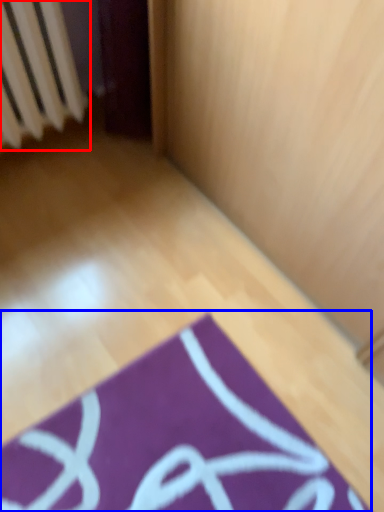
Question: Which point is further to the camera, radiator (highlighted by a red box) or yoga mat (highlighted by a blue box)?

Choices:
 (A) radiator
 (B) yoga mat

Answer: (A)